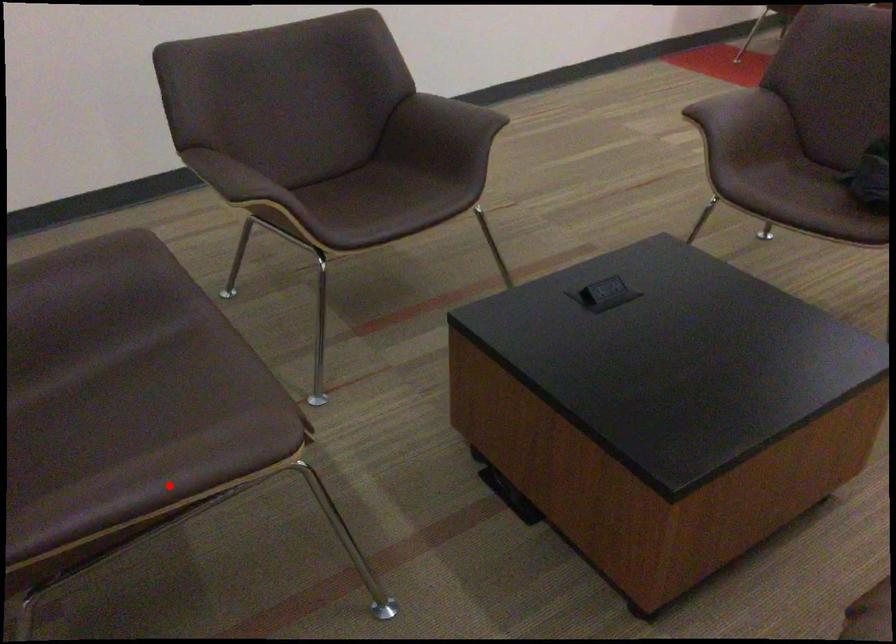
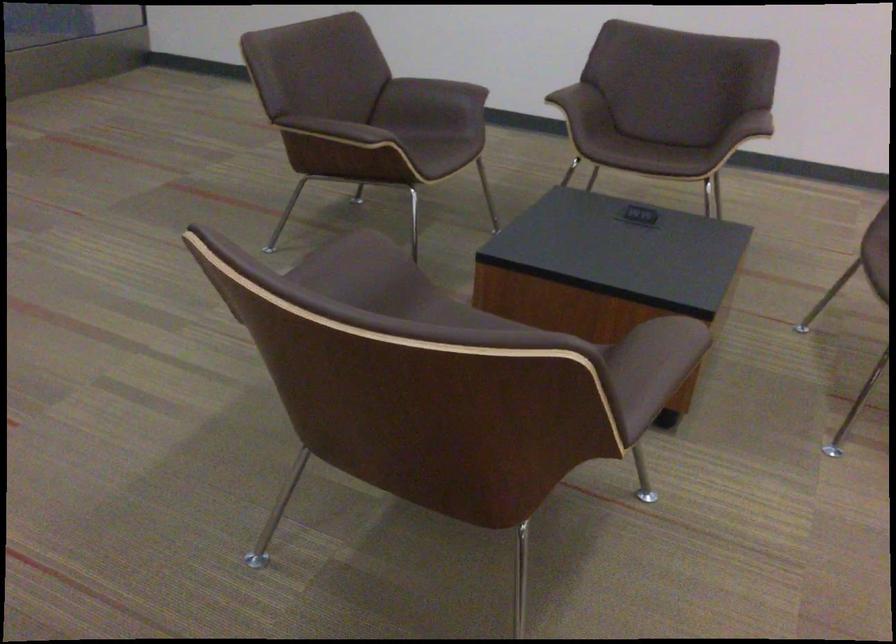
The point at the highlighted location is marked in the first image. Where is the corresponding point in the second image?

(334, 129)